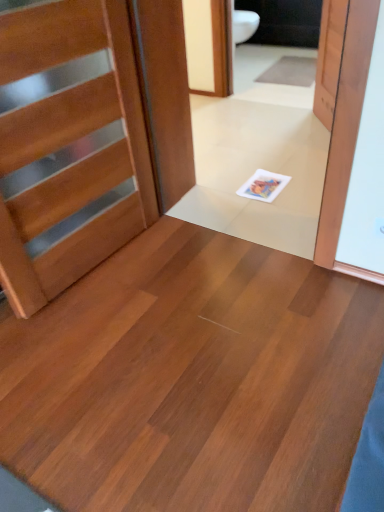
Locate an element on the screen. The height and width of the screenshot is (512, 384). free space in front of wooden door at left, marked as the 1th door in a left-to-right arrangement is located at coordinates (112, 337).